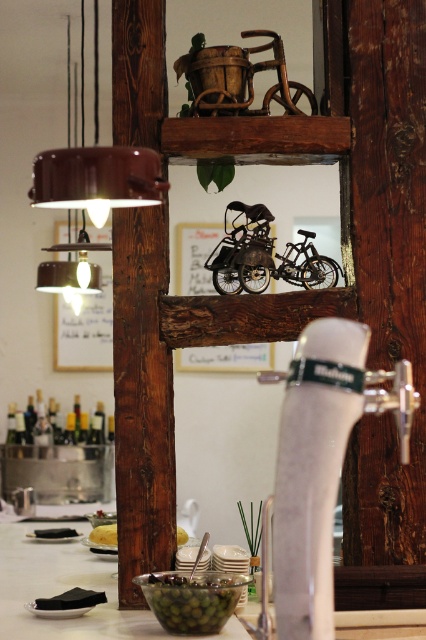
Question: Can you confirm if white matte faucet at center is wider than green matte bowl at lower center?

Choices:
 (A) yes
 (B) no

Answer: (B)

Question: Can you confirm if black matte olive at lower left is thinner than yellow cake at center?

Choices:
 (A) no
 (B) yes

Answer: (A)

Question: Among these objects, which one is nearest to the camera?

Choices:
 (A) black matte olive at lower left
 (B) brown matte lampshade at upper left

Answer: (B)

Question: Is black matte olive at lower left to the left of yellow cake at center from the viewer's perspective?

Choices:
 (A) no
 (B) yes

Answer: (A)

Question: Which point is farther to the camera?

Choices:
 (A) (111, 540)
 (B) (114, 525)
 (C) (106, 163)
 (D) (161, 580)

Answer: (B)

Question: Which object is positioned closest to the black matte olive at lower left?

Choices:
 (A) yellow cake at center
 (B) white matte faucet at center

Answer: (A)